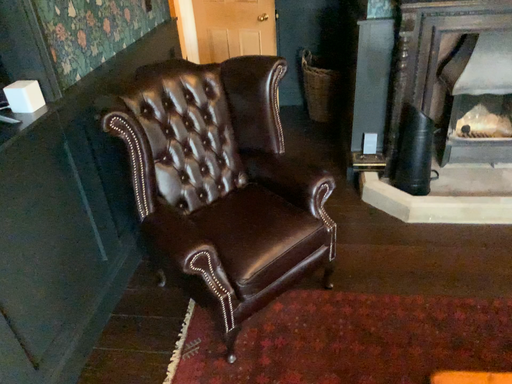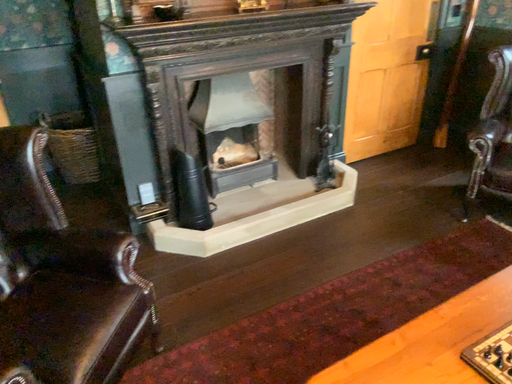
Question: Which way did the camera rotate in the video?

Choices:
 (A) rotated left
 (B) rotated right

Answer: (B)